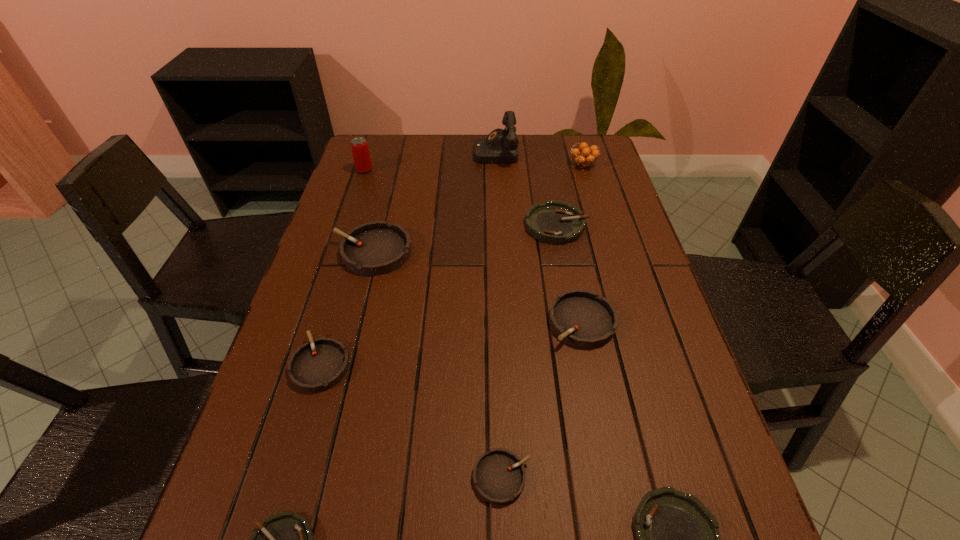
I want to click on object positioned at the far right corner, so click(x=583, y=158).

In order to click on vacant region at the far edge of the desktop in this screenshot , I will do `click(549, 134)`.

Image resolution: width=960 pixels, height=540 pixels. Find the location of `free space at the left edge of the desktop`. free space at the left edge of the desktop is located at coordinates (319, 463).

This screenshot has width=960, height=540. I want to click on vacant area at the right edge, so click(616, 211).

In the image, there is a desktop. Where is `free region at the far left corner`? The height and width of the screenshot is (540, 960). free region at the far left corner is located at coordinates (390, 146).

You are a GUI agent. You are given a task and a screenshot of the screen. Output one action in this format:
    pyautogui.click(x=<x>, y=<y>)
    Task: Click on the free space at the far right corner of the desktop
    The width and height of the screenshot is (960, 540).
    Given the screenshot: What is the action you would take?
    558,140

Identify the location of free space between the farthest green ashtray and the second smallest gray ashtray. This screenshot has height=540, width=960. (439, 295).

Find the location of a particular element. Image resolution: width=960 pixels, height=540 pixels. vacant point located between the ninth shortest object and the tallest object is located at coordinates (430, 161).

This screenshot has width=960, height=540. Identify the location of empty location between the third tallest object and the biggest gray ashtray. (478, 208).

The width and height of the screenshot is (960, 540). I want to click on free space between the tallest ashtray and the gray telephone, so click(x=434, y=201).